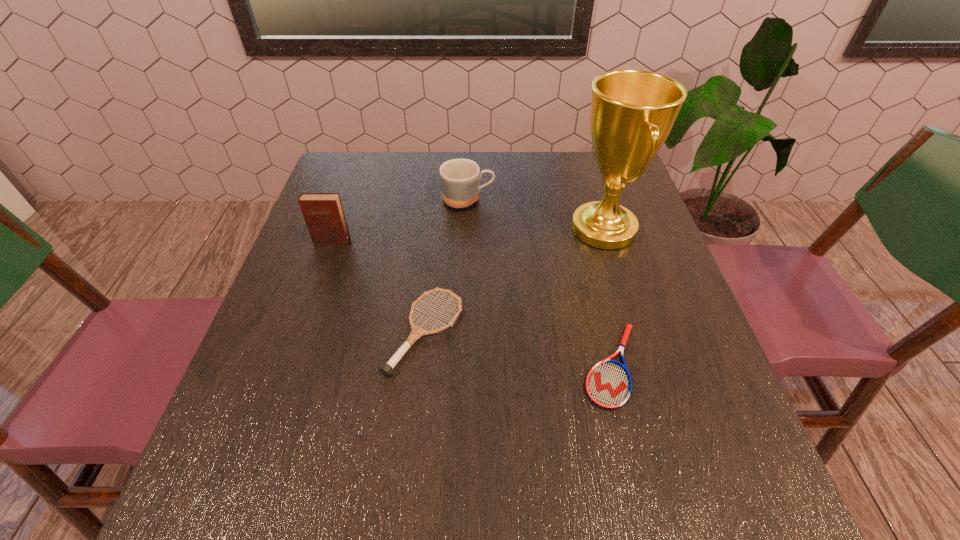
The image size is (960, 540). Identify the location of free space located by the handles of the tallest object. (516, 229).

The image size is (960, 540). Find the location of `blank area located on the front cover of the second tallest object`. blank area located on the front cover of the second tallest object is located at coordinates (304, 320).

Identify the location of free region located 0.300m on the side with the handle of the third tallest object. This screenshot has height=540, width=960. (605, 200).

Locate an element on the screen. free space located on the left of the fourth tallest object is located at coordinates point(278,332).

Where is `vacant area located 0.330m on the left of the shorter tennis racket`? This screenshot has width=960, height=540. vacant area located 0.330m on the left of the shorter tennis racket is located at coordinates (406, 366).

I want to click on award positioned at the far edge, so click(633, 111).

Where is `mug positioned at the far edge`? The image size is (960, 540). mug positioned at the far edge is located at coordinates (459, 178).

At what (x,y) coordinates should I click in order to perform the action: click on object that is at the left edge. Please return your answer as a coordinate pair (x, y). Image resolution: width=960 pixels, height=540 pixels. Looking at the image, I should click on (323, 213).

At what (x,y) coordinates should I click in order to perform the action: click on award that is at the right edge. Please return your answer as a coordinate pair (x, y). Looking at the image, I should click on coord(633,111).

In order to click on tennis racket that is positioned at the right edge in this screenshot , I will do (x=608, y=385).